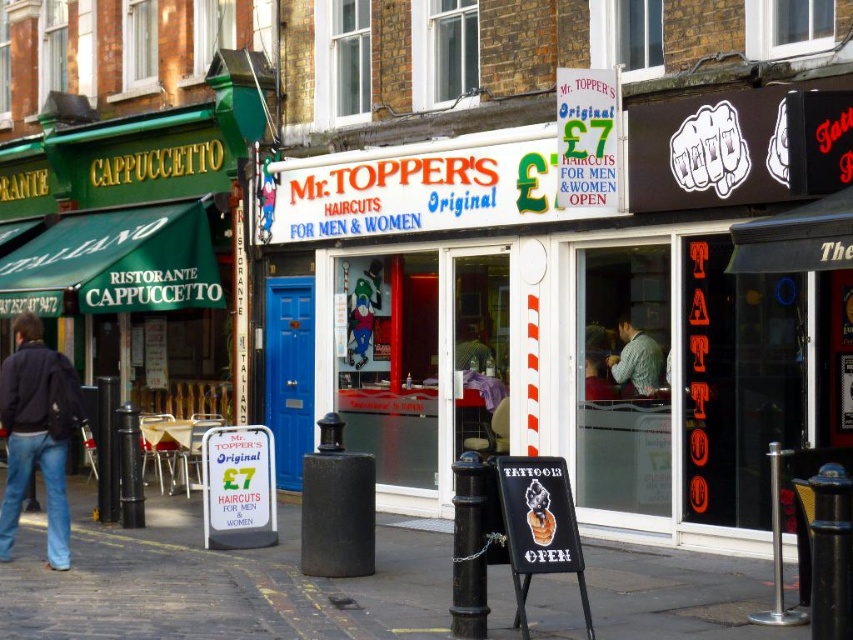
You are a tailor observing two garments in a busy street scene. You see a dark blue jacket at lower left and a knitted green sweater at center. Which garment appears taller when viewed from your position?

The dark blue jacket at lower left appears taller than the knitted green sweater at center.

Looking at this image, you are a delivery person trying to place a knitted green sweater at center on the smooth concrete pavement at center. Will the sweater fit entirely on the pavement?

The smooth concrete pavement at center occupies less space than knitted green sweater at center, so the sweater will not fit entirely on the pavement.

You are standing on the smooth concrete pavement at center and want to reach the dark blue jacket at lower left. Which direction should you move?

The smooth concrete pavement at center is in front of the dark blue jacket at lower left, so you should move backward to reach the dark blue jacket at lower left.